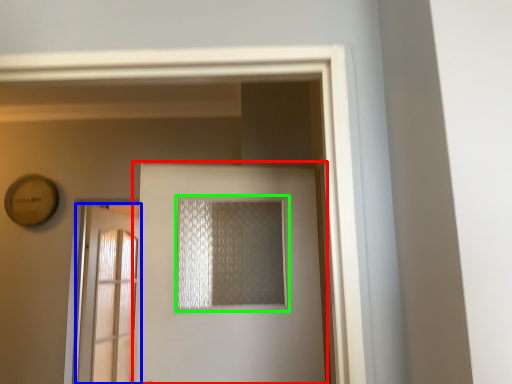
Question: Considering the real-world distances, which object is farthest from door (highlighted by a red box)? door (highlighted by a blue box) or window (highlighted by a green box)?

Choices:
 (A) door
 (B) window

Answer: (A)